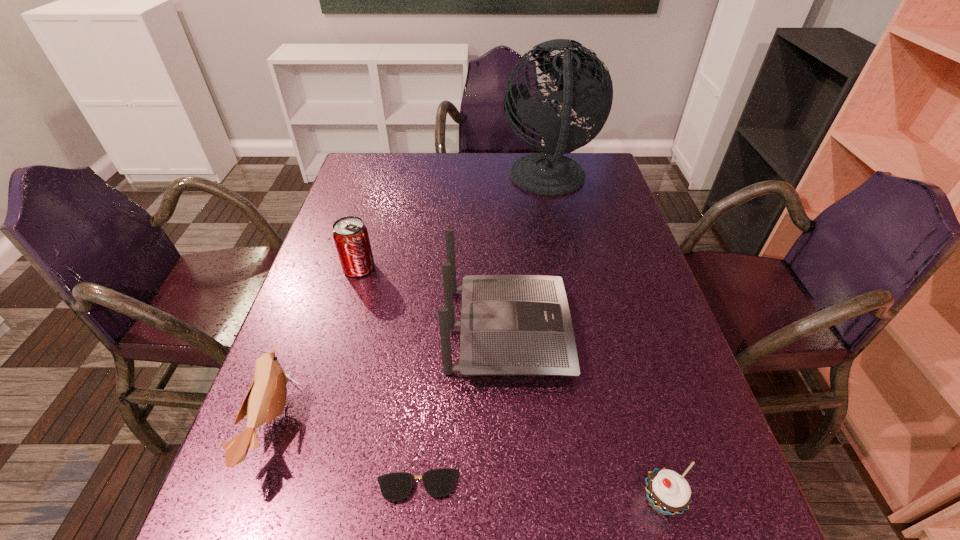
Find the location of a particular element. cupcake that is positioned at the right edge is located at coordinates (668, 493).

The height and width of the screenshot is (540, 960). I want to click on object that is at the far right corner, so click(x=587, y=85).

Where is `free space at the far edge`? This screenshot has width=960, height=540. free space at the far edge is located at coordinates (460, 166).

You are a GUI agent. You are given a task and a screenshot of the screen. Output one action in this format:
    pyautogui.click(x=<x>, y=<y>)
    Task: Click on the free region at the left edge
    Image resolution: width=960 pixels, height=540 pixels.
    Given the screenshot: What is the action you would take?
    pyautogui.click(x=324, y=397)

What are the coordinates of `vacant space at the right edge of the desktop` in the screenshot? It's located at (601, 281).

Image resolution: width=960 pixels, height=540 pixels. In order to click on vacant position at the far left corner of the desktop in this screenshot , I will do `click(383, 179)`.

Where is `free space that is in between the globe and the fifth object from right to left`? Image resolution: width=960 pixels, height=540 pixels. free space that is in between the globe and the fifth object from right to left is located at coordinates (453, 224).

In order to click on free space between the fifth object from right to left and the globe in this screenshot , I will do `click(453, 224)`.

I want to click on blank region between the bird and the second shortest object, so click(x=467, y=463).

Find the location of a particular element. The image size is (960, 540). free spot between the spectacles and the second tallest object is located at coordinates (463, 408).